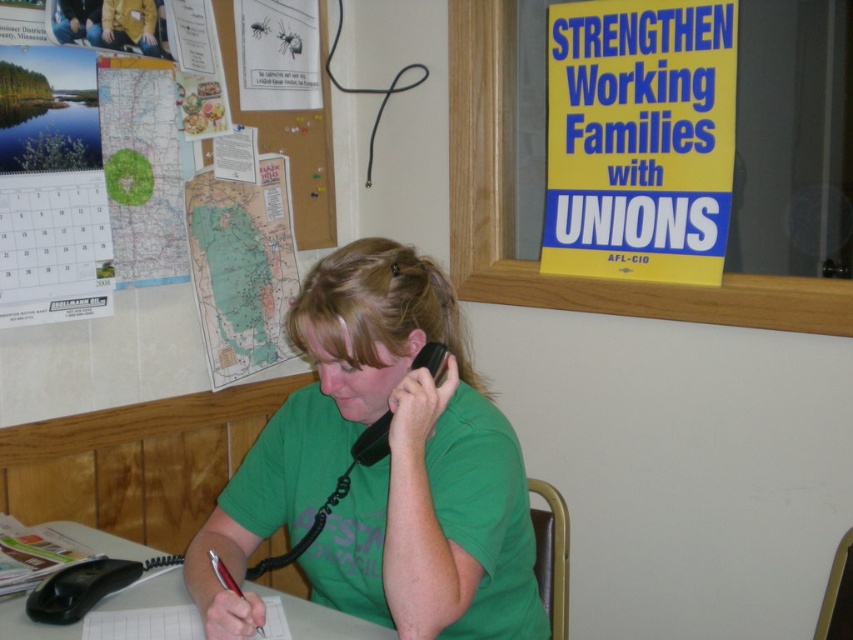
You are a photographer trying to capture a closeup of the desk items. You notice two points on the desk marked as point (583, 33) and point (286, 604). Which point should you focus on to ensure the closest possible focus for your camera?

Point (583, 33) is further to the camera than point (286, 604), so focusing on point (583, 33) will allow the camera to capture the closest focus.